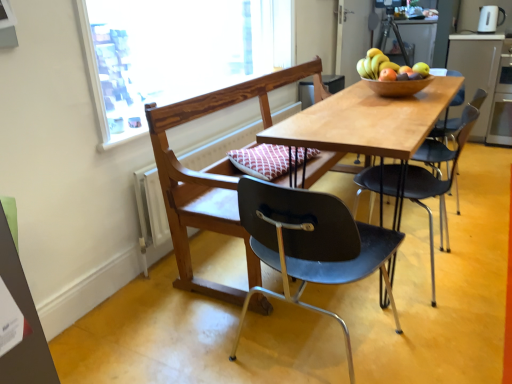
Question: Can you confirm if matte black chair at center, which is the 3th chair from front to back, is thinner than green cardboard bulletin board at lower left?

Choices:
 (A) no
 (B) yes

Answer: (A)

Question: Is matte black chair at center, arranged as the 1th chair when viewed from the back, at the left side of green cardboard bulletin board at lower left?

Choices:
 (A) yes
 (B) no

Answer: (B)

Question: Can you confirm if matte black chair at center, arranged as the 1th chair when viewed from the back, is bigger than green cardboard bulletin board at lower left?

Choices:
 (A) no
 (B) yes

Answer: (B)

Question: Is matte black chair at center, which is the 3th chair from front to back, shorter than green cardboard bulletin board at lower left?

Choices:
 (A) yes
 (B) no

Answer: (B)

Question: Is matte black chair at center, which is the 3th chair from front to back, positioned with its back to green cardboard bulletin board at lower left?

Choices:
 (A) no
 (B) yes

Answer: (A)

Question: Considering the positions of wooden chair at center, positioned as the second chair in back-to-front order, and smooth yellow pear at upper right, which ranks as the 2th fruit in left-to-right order, in the image, is wooden chair at center, positioned as the second chair in back-to-front order, wider or thinner than smooth yellow pear at upper right, which ranks as the 2th fruit in left-to-right order,?

Choices:
 (A) thin
 (B) wide

Answer: (B)

Question: Is point (226, 205) closer or farther from the camera than point (423, 64)?

Choices:
 (A) farther
 (B) closer

Answer: (B)

Question: In terms of height, does wooden chair at center, which appears as the 2th chair when viewed from the front, look taller or shorter compared to smooth yellow pear at upper right, which ranks as the 2th fruit in left-to-right order?

Choices:
 (A) tall
 (B) short

Answer: (A)

Question: Would you say wooden chair at center, which appears as the 2th chair when viewed from the front, is inside or outside smooth yellow pear at upper right, which ranks as the 2th fruit in left-to-right order?

Choices:
 (A) outside
 (B) inside

Answer: (A)

Question: Is wooden chair at center, which appears as the 2th chair when viewed from the front, wider or thinner than matte black chair at center, which appears as the first chair when viewed from the front?

Choices:
 (A) wide
 (B) thin

Answer: (B)

Question: Does point (241, 99) appear closer or farther from the camera than point (349, 344)?

Choices:
 (A) farther
 (B) closer

Answer: (A)

Question: From a real-world perspective, is wooden chair at center, positioned as the second chair in back-to-front order, positioned above or below matte black chair at center, which appears as the first chair when viewed from the front?

Choices:
 (A) above
 (B) below

Answer: (A)

Question: Is wooden chair at center, positioned as the second chair in back-to-front order, spatially inside matte black chair at center, positioned as the third chair in back-to-front order, or outside of it?

Choices:
 (A) outside
 (B) inside

Answer: (A)

Question: Considering the positions of point (370, 77) and point (415, 71), is point (370, 77) closer or farther from the camera than point (415, 71)?

Choices:
 (A) closer
 (B) farther

Answer: (B)

Question: Considering their positions, is shiny brown bowl at upper right, which is the first fruit in left-to-right order, located in front of or behind smooth yellow pear at upper right, arranged as the 1th fruit when viewed from the right?

Choices:
 (A) front
 (B) behind

Answer: (A)